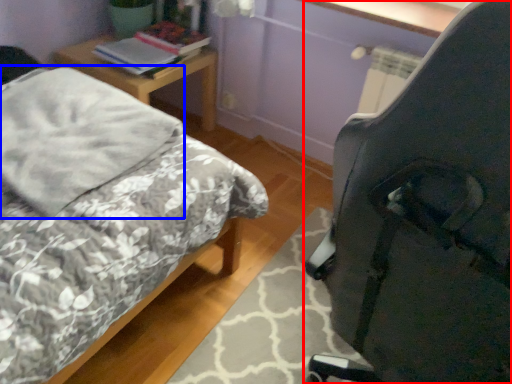
Question: Among these objects, which one is nearest to the camera, chair (highlighted by a red box) or pillow (highlighted by a blue box)?

Choices:
 (A) chair
 (B) pillow

Answer: (A)